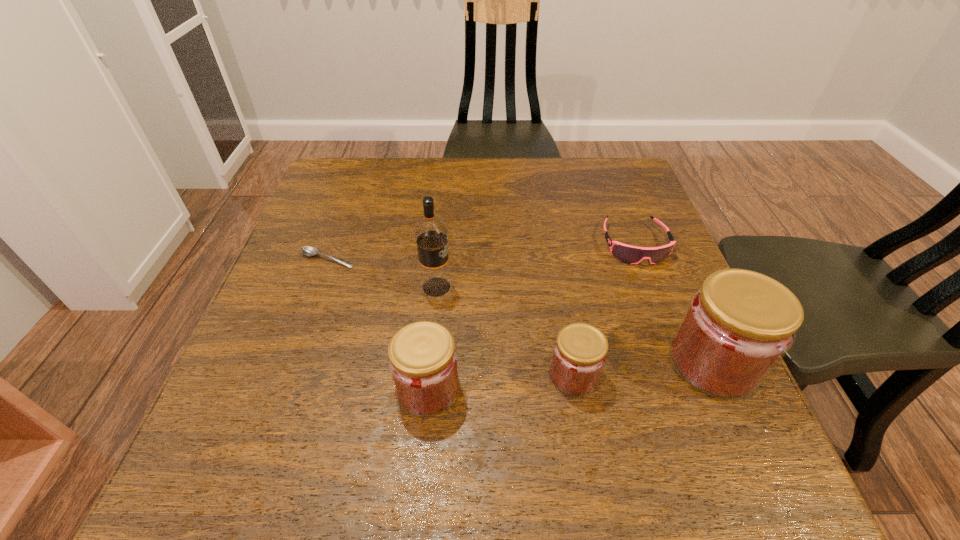
All jams are currently evenly spaced. To continue this pattern, where would you add another jam on the left? Please point out a vacant spot. Please provide its 2D coordinates. Your answer should be formatted as a tuple, i.e. [(x, y)], where the tuple contains the x and y coordinates of a point satisfying the conditions above.

[(275, 401)]